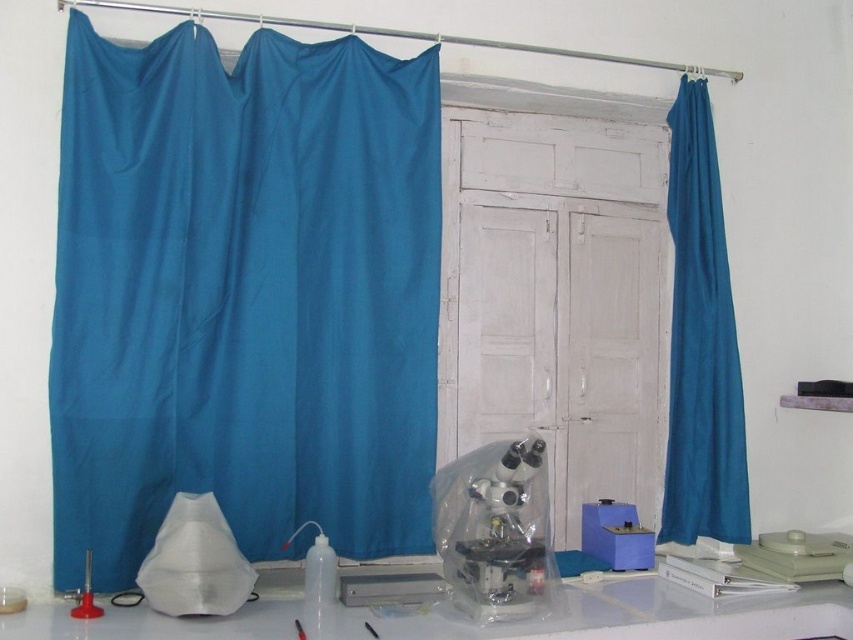
Does teal fabric curtain at right have a lesser height compared to matte red stand at lower left?

Incorrect, teal fabric curtain at right's height does not fall short of matte red stand at lower left's.

The width and height of the screenshot is (853, 640). I want to click on teal fabric curtain at right, so click(701, 342).

The width and height of the screenshot is (853, 640). What are the coordinates of `teal fabric curtain at right` in the screenshot? It's located at (701, 342).

Can you confirm if teal fabric curtain at left is wider than matte red stand at lower left?

Correct, the width of teal fabric curtain at left exceeds that of matte red stand at lower left.

How far apart are teal fabric curtain at left and matte red stand at lower left?

The distance of teal fabric curtain at left from matte red stand at lower left is 26.70 inches.

Find the location of a particular element. The image size is (853, 640). teal fabric curtain at left is located at coordinates (242, 294).

Measure the distance between white plastic table at lower center and clear plastic microscope at center.

white plastic table at lower center and clear plastic microscope at center are 9.52 inches apart from each other.

Can you confirm if white plastic table at lower center is positioned above clear plastic microscope at center?

Incorrect, white plastic table at lower center is not positioned above clear plastic microscope at center.

Is point (94, 632) closer to camera compared to point (473, 532)?

Yes, point (94, 632) is in front of point (473, 532).

Locate an element on the screen. white plastic table at lower center is located at coordinates (486, 625).